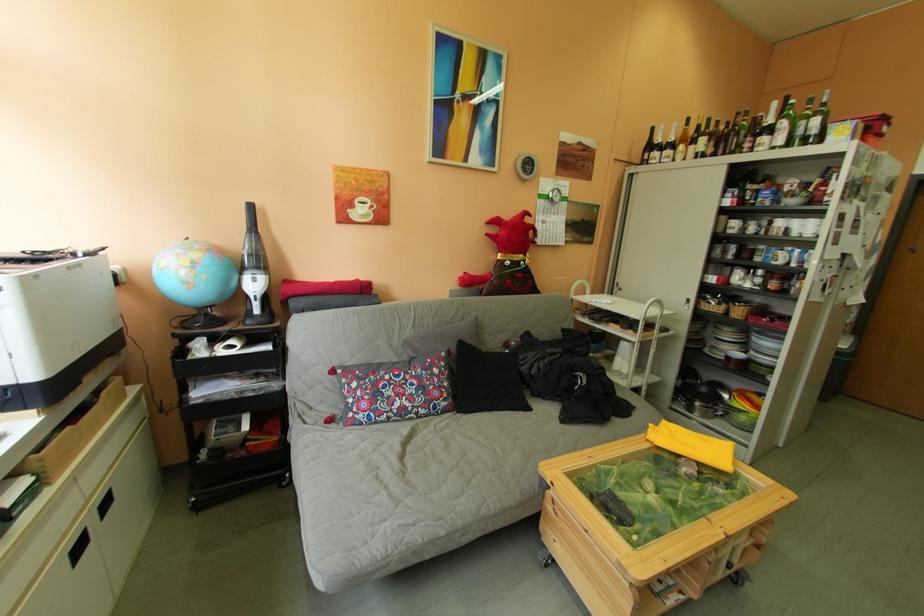
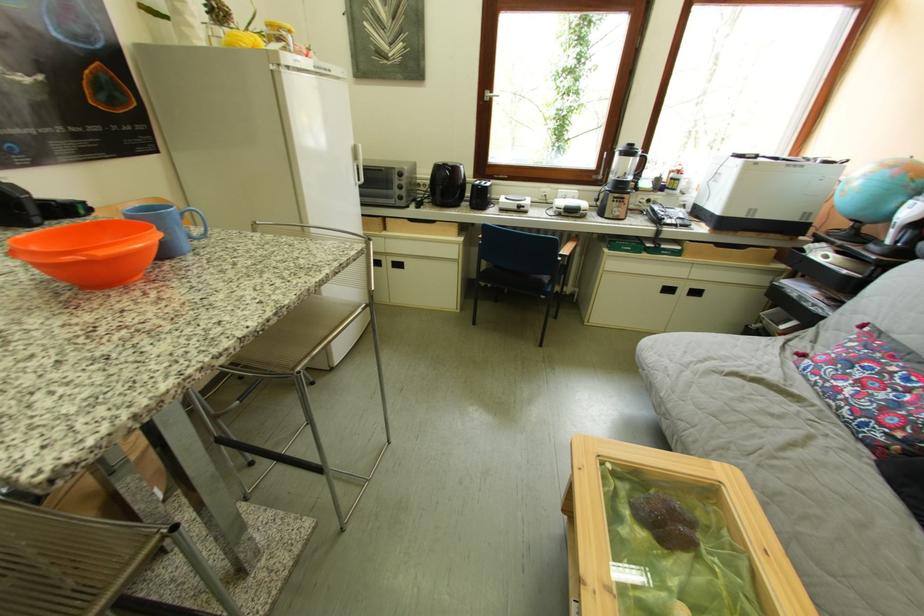
Locate, in the second image, the point that corresponds to the point at 207,265 in the first image.

(877, 177)